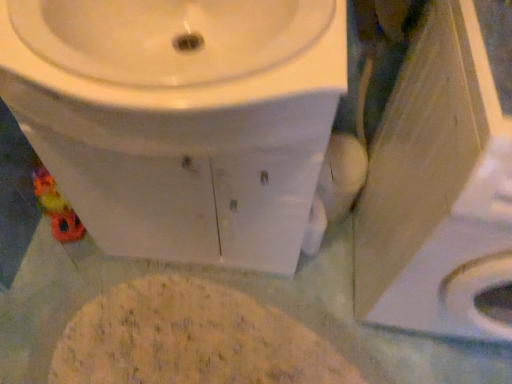
Measure the distance between point (347, 372) and camera.

They are 1.17 meters apart.

Where is `white glossy sink at upper center`? The width and height of the screenshot is (512, 384). white glossy sink at upper center is located at coordinates (176, 66).

Where is `toilet located above the yellowish powder at center (from the image's perspective)`? This screenshot has height=384, width=512. toilet located above the yellowish powder at center (from the image's perspective) is located at coordinates (180, 119).

Which object is closer to the camera, yellowish powder at center or white glossy toilet at center?

white glossy toilet at center is closer to the camera.

Between yellowish powder at center and white glossy toilet at center, which one has smaller size?

yellowish powder at center.

Which is nearer, (177, 337) or (144, 225)?

Point (177, 337).

Is white glossy sink at upper center a part of yellowish powder at center?

No, white glossy sink at upper center is located outside of yellowish powder at center.

Considering the sizes of yellowish powder at center and white glossy sink at upper center in the image, is yellowish powder at center wider or thinner than white glossy sink at upper center?

In the image, yellowish powder at center appears to be more narrow than white glossy sink at upper center.

The image size is (512, 384). Identify the location of flour below the white glossy sink at upper center (from the image's perspective). 191,339.

Are yellowish powder at center and white glossy sink at upper center located far from each other?

No, yellowish powder at center is not far away from white glossy sink at upper center.

From a real-world perspective, is white glossy sink at upper center on white glossy toilet at center?

Yes, from a real-world perspective, white glossy sink at upper center is above white glossy toilet at center.

Considering the positions of point (21, 16) and point (125, 123), is point (21, 16) closer or farther from the camera than point (125, 123)?

Point (21, 16) is farther from the camera than point (125, 123).

Does white glossy sink at upper center touch white glossy toilet at center?

No, white glossy sink at upper center is not next to white glossy toilet at center.

Is white glossy sink at upper center at the left side of white glossy toilet at center?

No.

Is white glossy sink at upper center not near yellowish powder at center?

white glossy sink at upper center is actually quite close to yellowish powder at center.

In the image, is white glossy sink at upper center positioned in front of or behind yellowish powder at center?

In the image, white glossy sink at upper center appears in front of yellowish powder at center.

Based on their positions, is white glossy sink at upper center located to the left or right of yellowish powder at center?

In the image, white glossy sink at upper center appears on the right side of yellowish powder at center.

Does white glossy toilet at center contain yellowish powder at center?

That's incorrect, yellowish powder at center is not inside white glossy toilet at center.

Between white glossy toilet at center and yellowish powder at center, which one is positioned behind?

Positioned behind is yellowish powder at center.

Considering the relative sizes of white glossy toilet at center and yellowish powder at center in the image provided, is white glossy toilet at center wider than yellowish powder at center?

Correct, the width of white glossy toilet at center exceeds that of yellowish powder at center.

What's the angular difference between white glossy toilet at center and white glossy sink at upper center's facing directions?

The facing directions of white glossy toilet at center and white glossy sink at upper center are 0.00248 degrees apart.

Considering the sizes of objects white glossy toilet at center and white glossy sink at upper center in the image provided, who is shorter, white glossy toilet at center or white glossy sink at upper center?

Standing shorter between the two is white glossy sink at upper center.

Looking at their sizes, would you say white glossy toilet at center is wider or thinner than white glossy sink at upper center?

white glossy toilet at center is thinner than white glossy sink at upper center.

Identify the location of flour below the white glossy toilet at center (from the image's perspective). (191, 339).

Where is `flour that is on the left side of white glossy sink at upper center`? This screenshot has width=512, height=384. flour that is on the left side of white glossy sink at upper center is located at coordinates (191, 339).

From the image, which object appears to be farther from white glossy sink at upper center, yellowish powder at center or white glossy toilet at center?

yellowish powder at center.

Consider the image. When comparing their distances from white glossy toilet at center, does white glossy sink at upper center or yellowish powder at center seem closer?

white glossy sink at upper center is closer to white glossy toilet at center.

From the picture: Looking at the image, which one is located further to white glossy toilet at center, yellowish powder at center or white glossy sink at upper center?

yellowish powder at center.

Consider the image. Based on their spatial positions, is white glossy sink at upper center or white glossy toilet at center further from yellowish powder at center?

white glossy sink at upper center is further to yellowish powder at center.

Based on their spatial positions, is white glossy toilet at center or yellowish powder at center closer to white glossy sink at upper center?

white glossy toilet at center is closer to white glossy sink at upper center.

Estimate the real-world distances between objects in this image. Which object is further from yellowish powder at center, white glossy toilet at center or white glossy sink at upper center?

Based on the image, white glossy sink at upper center appears to be further to yellowish powder at center.

This screenshot has height=384, width=512. I want to click on toilet that lies between white glossy sink at upper center and yellowish powder at center from top to bottom, so click(x=180, y=119).